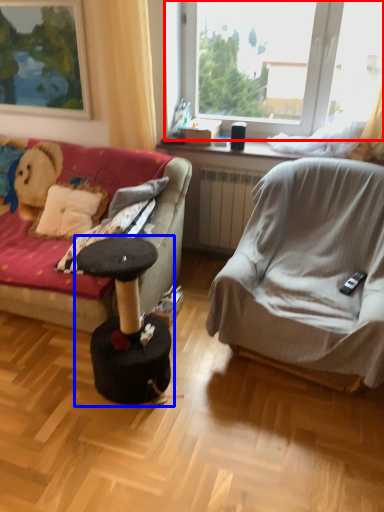
Question: Which of the following is the closest to the observer, window (highlighted by a red box) or music stool (highlighted by a blue box)?

Choices:
 (A) window
 (B) music stool

Answer: (B)